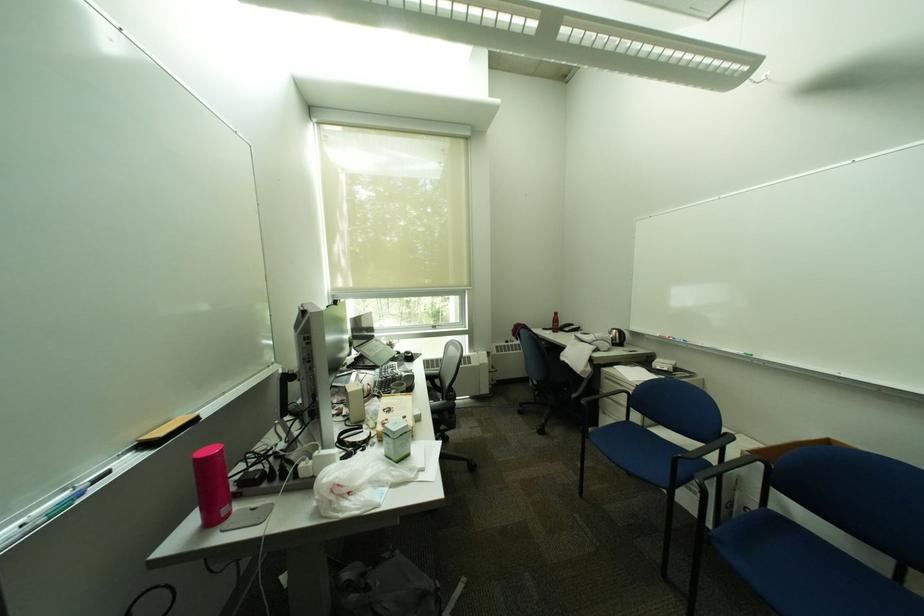
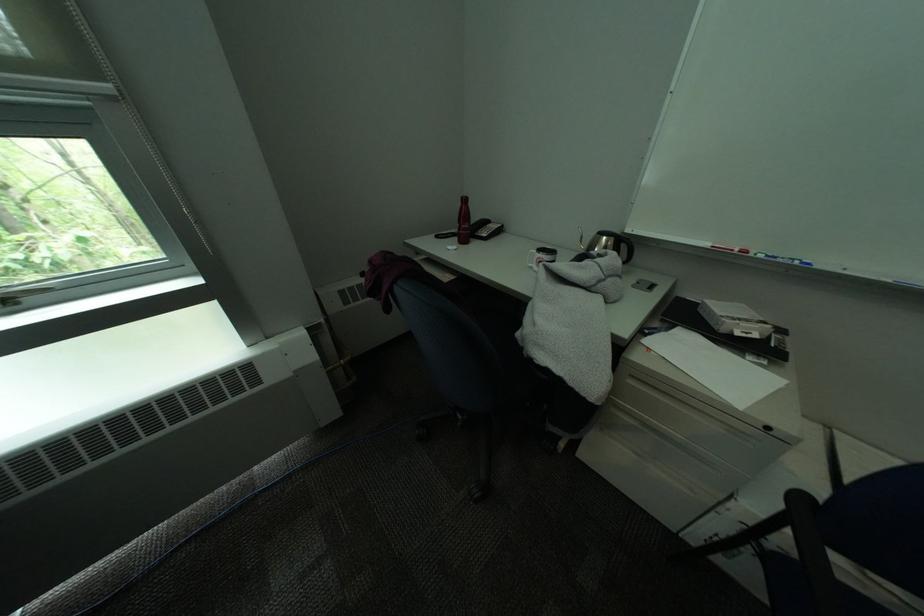
The point at (687,341) is marked in the first image. Where is the corresponding point in the second image?

(791, 262)